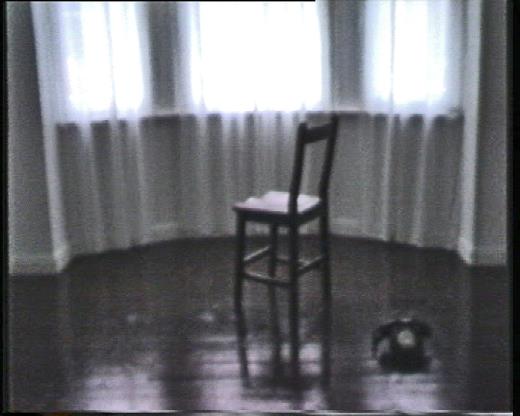
The width and height of the screenshot is (520, 416). I want to click on window, so click(239, 69).